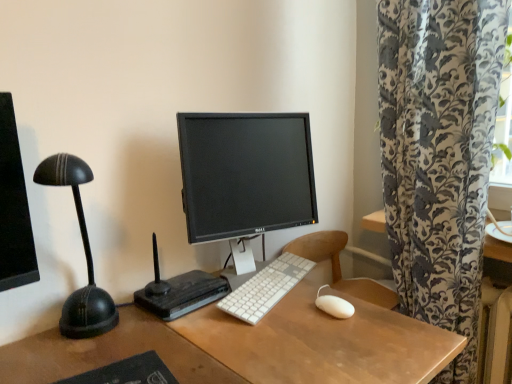
Question: Can you confirm if black plastic router at center is wider than white plastic keyboard at center?

Choices:
 (A) yes
 (B) no

Answer: (A)

Question: Considering the relative sizes of black plastic router at center and white plastic keyboard at center in the image provided, is black plastic router at center shorter than white plastic keyboard at center?

Choices:
 (A) no
 (B) yes

Answer: (A)

Question: Does black plastic router at center have a lesser width compared to white plastic keyboard at center?

Choices:
 (A) no
 (B) yes

Answer: (A)

Question: From the image's perspective, is black plastic router at center over white plastic keyboard at center?

Choices:
 (A) no
 (B) yes

Answer: (B)

Question: Is black plastic router at center positioned beyond the bounds of white plastic keyboard at center?

Choices:
 (A) yes
 (B) no

Answer: (A)

Question: Is the position of black plastic router at center less distant than that of white plastic keyboard at center?

Choices:
 (A) yes
 (B) no

Answer: (A)

Question: Is there a large distance between white matte mouse at center and black plastic router at center?

Choices:
 (A) yes
 (B) no

Answer: (B)

Question: Considering the relative sizes of white matte mouse at center and black plastic router at center in the image provided, is white matte mouse at center shorter than black plastic router at center?

Choices:
 (A) yes
 (B) no

Answer: (A)

Question: Considering the relative positions of white matte mouse at center and black plastic router at center in the image provided, is white matte mouse at center in front of black plastic router at center?

Choices:
 (A) no
 (B) yes

Answer: (A)

Question: Is white matte mouse at center smaller than black plastic router at center?

Choices:
 (A) yes
 (B) no

Answer: (A)

Question: Can you confirm if white matte mouse at center is thinner than black plastic router at center?

Choices:
 (A) yes
 (B) no

Answer: (A)

Question: Considering the relative sizes of white matte mouse at center and black plastic router at center in the image provided, is white matte mouse at center wider than black plastic router at center?

Choices:
 (A) yes
 (B) no

Answer: (B)

Question: Considering the relative sizes of white matte mouse at center and white plastic keyboard at center in the image provided, is white matte mouse at center bigger than white plastic keyboard at center?

Choices:
 (A) yes
 (B) no

Answer: (B)